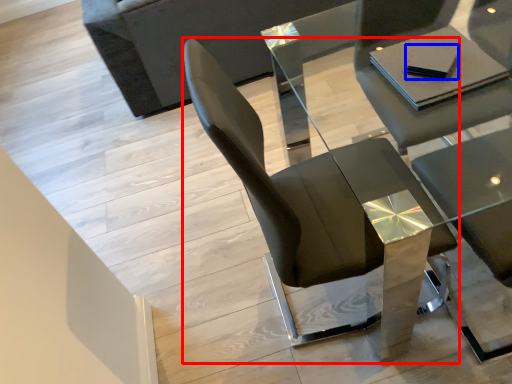
Question: Which of the following is the farthest to the observer, chair (highlighted by a red box) or pad (highlighted by a blue box)?

Choices:
 (A) chair
 (B) pad

Answer: (B)